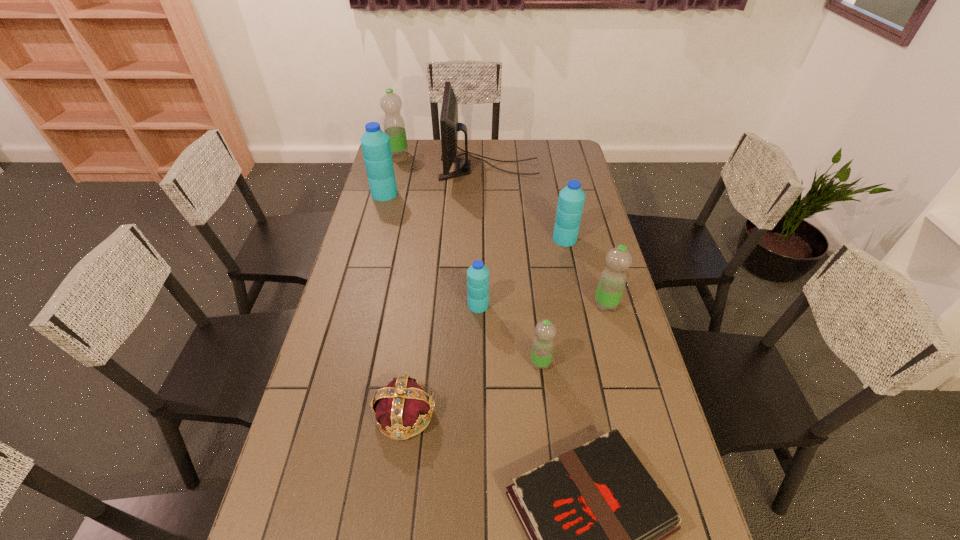
Where is `computer monitor`? This screenshot has height=540, width=960. computer monitor is located at coordinates (449, 126).

Where is `the leftmost green water bottle`? The width and height of the screenshot is (960, 540). the leftmost green water bottle is located at coordinates (394, 126).

Where is `the farthest green water bottle`? the farthest green water bottle is located at coordinates (394, 126).

Where is `the biggest blue water bottle`? The width and height of the screenshot is (960, 540). the biggest blue water bottle is located at coordinates (375, 143).

This screenshot has height=540, width=960. Identify the location of the leftmost blue water bottle. point(375,143).

The image size is (960, 540). Identify the location of the fifth water bottle from left to right. (571, 200).

Where is `the fourth farthest object`? This screenshot has width=960, height=540. the fourth farthest object is located at coordinates (571, 200).

Find the location of a particular element. This screenshot has width=960, height=540. the rightmost water bottle is located at coordinates (612, 281).

At what (x,y) coordinates should I click in order to perform the action: click on the second smallest green water bottle. Please return your answer as a coordinate pair (x, y). Image resolution: width=960 pixels, height=540 pixels. Looking at the image, I should click on (612, 281).

The width and height of the screenshot is (960, 540). Find the location of `the fourth water bottle from left to right`. the fourth water bottle from left to right is located at coordinates (543, 344).